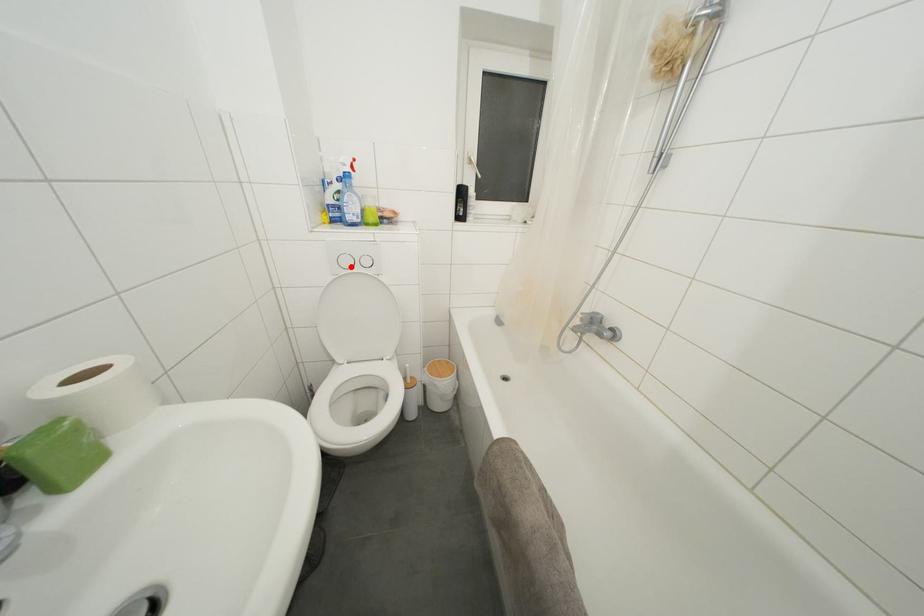
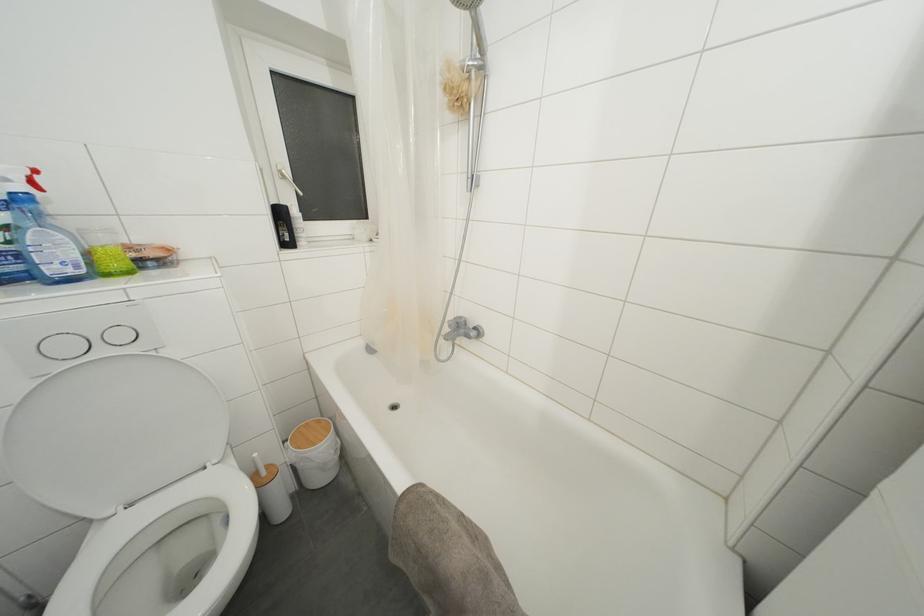
Locate, in the second image, the point that corresponds to the highlighted location in the first image.

(71, 352)